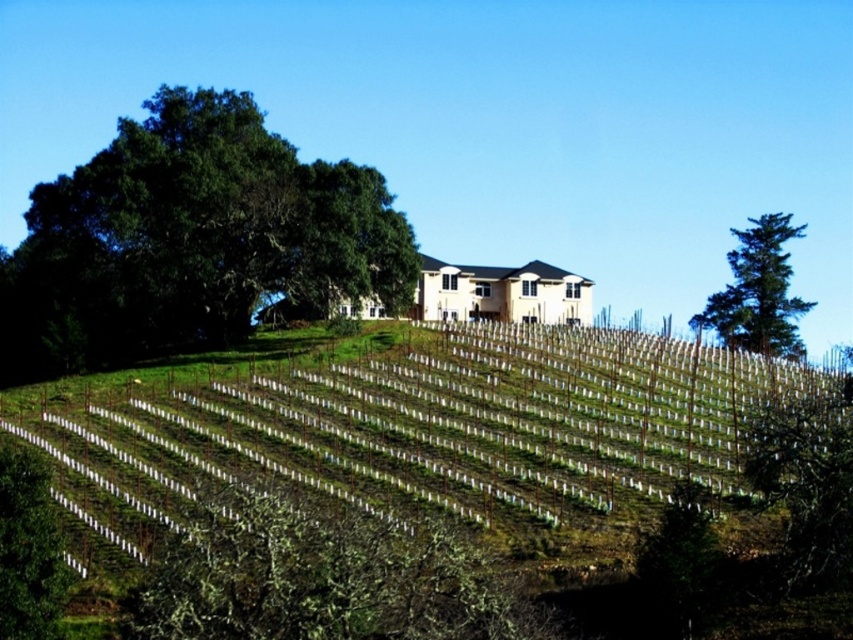
Question: Is green leafy tree at upper left above green textured tree at right?

Choices:
 (A) no
 (B) yes

Answer: (B)

Question: Which object is closer to the camera taking this photo?

Choices:
 (A) green textured tree at right
 (B) green leafy tree at upper left

Answer: (B)

Question: From the image, what is the correct spatial relationship of green leafy tree at upper left in relation to green textured tree at right?

Choices:
 (A) above
 (B) below

Answer: (A)

Question: Which point is farther from the camera taking this photo?

Choices:
 (A) (270, 198)
 (B) (778, 312)

Answer: (B)

Question: Can you confirm if green leafy tree at upper left is positioned above green textured tree at right?

Choices:
 (A) yes
 (B) no

Answer: (A)